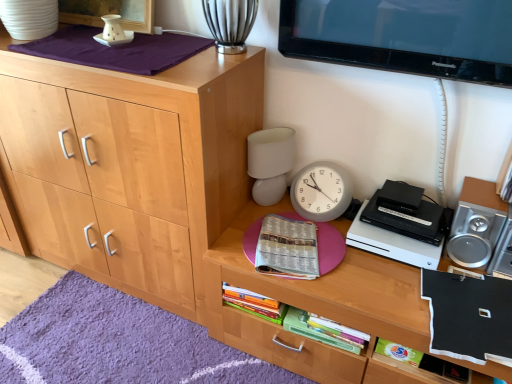
Where is `free point above purple soft rug at lower left (from a real-world perspective)`? free point above purple soft rug at lower left (from a real-world perspective) is located at coordinates (99, 343).